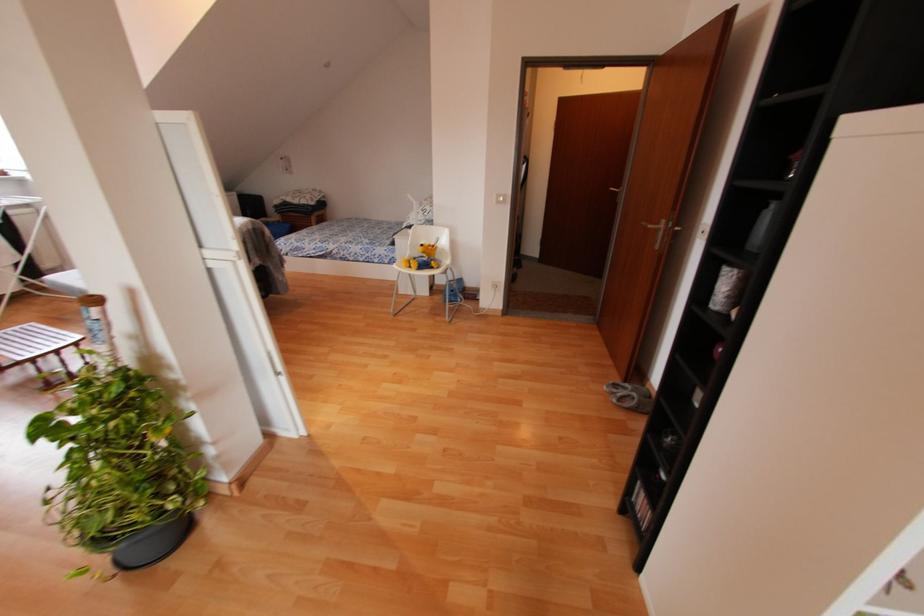
Find the location of a particular element. The height and width of the screenshot is (616, 924). silver door handle is located at coordinates (655, 228).